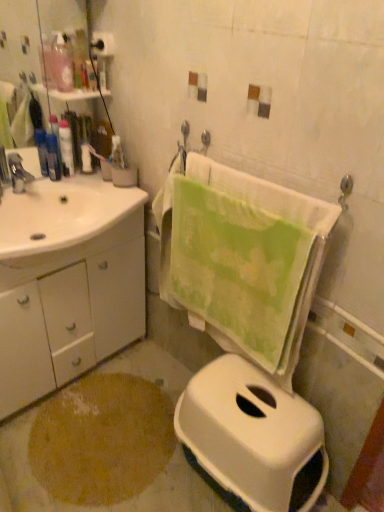
Question: Considering the relative sizes of matte black lotion at left, which appears as the first toiletry when ordered from the bottom, and translucent plastic bottle at upper left, arranged as the 3th toiletry when viewed from the left, in the image provided, is matte black lotion at left, which appears as the first toiletry when ordered from the bottom, wider than translucent plastic bottle at upper left, arranged as the 3th toiletry when viewed from the left,?

Choices:
 (A) yes
 (B) no

Answer: (A)

Question: Is matte black lotion at left, placed as the 3th toiletry when sorted from top to bottom, not near translucent plastic bottle at upper left, placed as the 1th toiletry when sorted from right to left?

Choices:
 (A) yes
 (B) no

Answer: (B)

Question: From the image's perspective, is matte black lotion at left, which appears as the first toiletry when ordered from the bottom, beneath translucent plastic bottle at upper left, placed as the third toiletry when sorted from bottom to top?

Choices:
 (A) no
 (B) yes

Answer: (B)

Question: Is matte black lotion at left, which is counted as the 3th toiletry, starting from the right, directly adjacent to translucent plastic bottle at upper left, the first toiletry positioned from the top?

Choices:
 (A) no
 (B) yes

Answer: (A)

Question: Considering the relative sizes of matte black lotion at left, which is counted as the 3th toiletry, starting from the right, and translucent plastic bottle at upper left, placed as the third toiletry when sorted from bottom to top, in the image provided, is matte black lotion at left, which is counted as the 3th toiletry, starting from the right, smaller than translucent plastic bottle at upper left, placed as the third toiletry when sorted from bottom to top,?

Choices:
 (A) no
 (B) yes

Answer: (A)

Question: Is matte black lotion at left, which is counted as the 3th toiletry, starting from the right, closer to the viewer compared to translucent plastic bottle at upper left, placed as the third toiletry when sorted from bottom to top?

Choices:
 (A) yes
 (B) no

Answer: (B)

Question: Are matte silver faucet at left and green cotton towel at center far apart?

Choices:
 (A) no
 (B) yes

Answer: (A)

Question: Is matte silver faucet at left smaller than green cotton towel at center?

Choices:
 (A) yes
 (B) no

Answer: (A)

Question: Is green cotton towel at center a part of matte silver faucet at left?

Choices:
 (A) no
 (B) yes

Answer: (A)

Question: Does matte silver faucet at left have a lesser width compared to green cotton towel at center?

Choices:
 (A) yes
 (B) no

Answer: (B)

Question: From a real-world perspective, is matte silver faucet at left on green cotton towel at center?

Choices:
 (A) no
 (B) yes

Answer: (B)

Question: Can you confirm if matte silver faucet at left is shorter than green cotton towel at center?

Choices:
 (A) no
 (B) yes

Answer: (B)

Question: Can you confirm if brown textured rug at lower left is wider than matte black lotion at left, which is the 1th toiletry in left-to-right order?

Choices:
 (A) no
 (B) yes

Answer: (B)